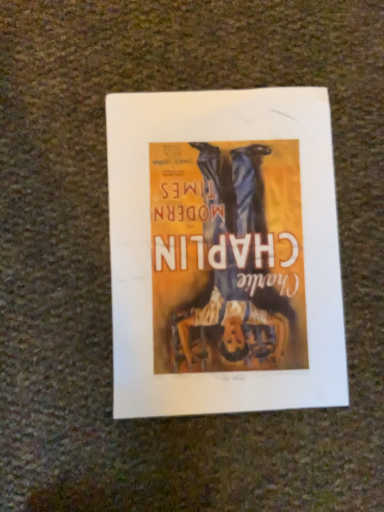
Find the location of a particular element. This screenshot has width=384, height=512. free space above matte paper poster at center (from a real-world perspective) is located at coordinates (227, 254).